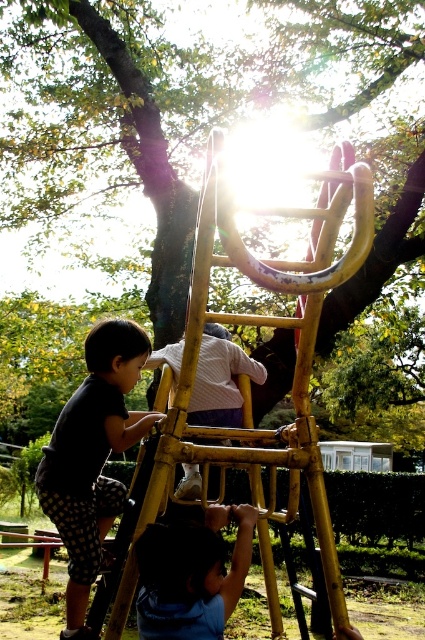
Question: Which of these objects is positioned farthest from the dark gray shirt at left?

Choices:
 (A) yellow wood ladder at center
 (B) green leafy tree at upper center
 (C) blue fabric pants at lower center

Answer: (B)

Question: Does gold metallic ladder at center appear under blue fabric pants at lower center?

Choices:
 (A) no
 (B) yes

Answer: (A)

Question: Considering the real-world distances, which object is closest to the gold metallic ladder at center?

Choices:
 (A) blue fabric pants at lower center
 (B) yellow wood ladder at center
 (C) dark gray shirt at left
 (D) green leafy tree at upper center

Answer: (C)

Question: Which point appears closest to the camera in this image?

Choices:
 (A) (90, 508)
 (B) (203, 563)
 (C) (200, 230)

Answer: (B)

Question: Can you confirm if dark gray shirt at left is positioned to the right of blue fabric pants at lower center?

Choices:
 (A) no
 (B) yes

Answer: (A)

Question: Is gold metallic ladder at center smaller than dark gray shirt at left?

Choices:
 (A) no
 (B) yes

Answer: (A)